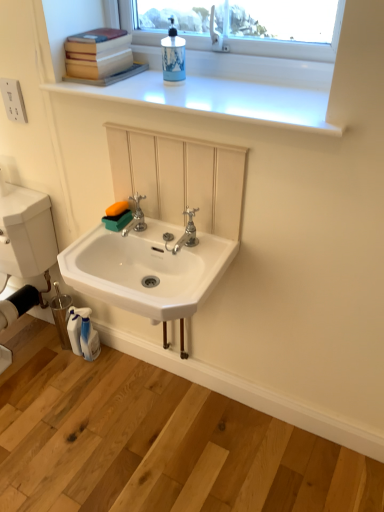
At what (x,y) coordinates should I click in order to perform the action: click on empty space that is ontop of white glossy window sill at upper center (from a real-world perspective). Please return your answer as a coordinate pair (x, y). This screenshot has width=384, height=512. Looking at the image, I should click on (209, 84).